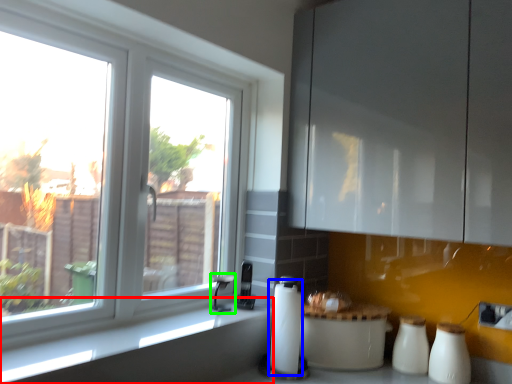
Question: Which object is positioned closest to counter top (highlighted by a red box)? Select from paper towel (highlighted by a blue box) and faucet (highlighted by a green box).

Choices:
 (A) paper towel
 (B) faucet

Answer: (A)